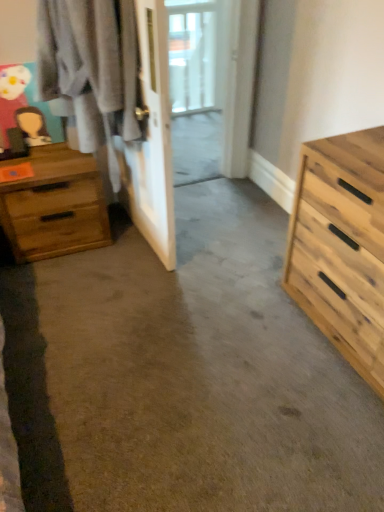
Question: Is wooden dresser at left thinner than wooden chest of drawers at left, marked as the 1th chest of drawers in a left-to-right arrangement?

Choices:
 (A) no
 (B) yes

Answer: (B)

Question: From a real-world perspective, is wooden dresser at left physically below wooden chest of drawers at left, which ranks as the 2th chest of drawers in front-to-back order?

Choices:
 (A) no
 (B) yes

Answer: (A)

Question: Can you confirm if wooden dresser at left is wider than wooden chest of drawers at left, which ranks as the 2th chest of drawers in front-to-back order?

Choices:
 (A) yes
 (B) no

Answer: (B)

Question: Considering the relative positions of wooden dresser at left and wooden chest of drawers at left, marked as the 1th chest of drawers in a left-to-right arrangement, in the image provided, is wooden dresser at left to the left of wooden chest of drawers at left, marked as the 1th chest of drawers in a left-to-right arrangement, from the viewer's perspective?

Choices:
 (A) no
 (B) yes

Answer: (A)

Question: Can you confirm if wooden dresser at left is positioned to the right of wooden chest of drawers at left, marked as the 1th chest of drawers in a left-to-right arrangement?

Choices:
 (A) no
 (B) yes

Answer: (B)

Question: From the image's perspective, is natural wood chest of drawers at right, the 2th chest of drawers in the back-to-front sequence, positioned above or below wooden dresser at left?

Choices:
 (A) above
 (B) below

Answer: (B)

Question: From a real-world perspective, relative to wooden dresser at left, is natural wood chest of drawers at right, the 2th chest of drawers in the back-to-front sequence, vertically above or below?

Choices:
 (A) above
 (B) below

Answer: (B)

Question: From their relative heights in the image, would you say natural wood chest of drawers at right, the 2th chest of drawers in the back-to-front sequence, is taller or shorter than wooden dresser at left?

Choices:
 (A) tall
 (B) short

Answer: (B)

Question: Is point (380, 355) positioned closer to the camera than point (165, 98)?

Choices:
 (A) closer
 (B) farther

Answer: (A)

Question: From the image's perspective, is wooden dresser at left located above or below natural wood chest of drawers at right, the 1th chest of drawers when ordered from right to left?

Choices:
 (A) below
 (B) above

Answer: (B)

Question: Choose the correct answer: Is wooden dresser at left inside natural wood chest of drawers at right, marked as the first chest of drawers in a front-to-back arrangement, or outside it?

Choices:
 (A) inside
 (B) outside

Answer: (B)

Question: From a real-world perspective, is wooden dresser at left above or below natural wood chest of drawers at right, the 2th chest of drawers in the back-to-front sequence?

Choices:
 (A) above
 (B) below

Answer: (A)

Question: From their relative heights in the image, would you say wooden dresser at left is taller or shorter than natural wood chest of drawers at right, the 1th chest of drawers when ordered from right to left?

Choices:
 (A) short
 (B) tall

Answer: (B)

Question: Considering the positions of point (317, 157) and point (104, 217), is point (317, 157) closer or farther from the camera than point (104, 217)?

Choices:
 (A) farther
 (B) closer

Answer: (B)

Question: Would you say natural wood chest of drawers at right, the 2th chest of drawers in the back-to-front sequence, is to the left or to the right of wooden chest of drawers at left, marked as the 1th chest of drawers in a left-to-right arrangement, in the picture?

Choices:
 (A) left
 (B) right

Answer: (B)